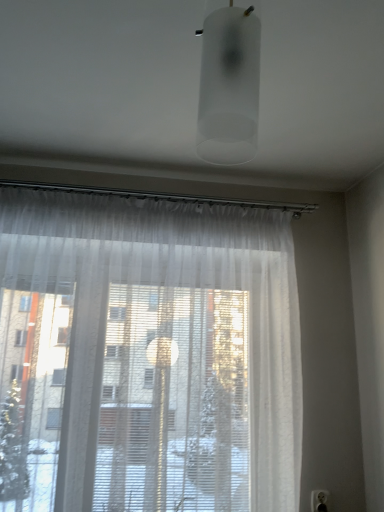
Question: Is sheer white curtain at center placed right next to white plastic electric outlet at lower right?

Choices:
 (A) no
 (B) yes

Answer: (A)

Question: Can you confirm if sheer white curtain at center is wider than white plastic electric outlet at lower right?

Choices:
 (A) yes
 (B) no

Answer: (A)

Question: Is white plastic electric outlet at lower right located within sheer white curtain at center?

Choices:
 (A) yes
 (B) no

Answer: (B)

Question: Does sheer white curtain at center have a lesser height compared to white plastic electric outlet at lower right?

Choices:
 (A) yes
 (B) no

Answer: (B)

Question: Is the position of sheer white curtain at center more distant than that of white plastic electric outlet at lower right?

Choices:
 (A) yes
 (B) no

Answer: (B)

Question: Is sheer white curtain at center facing away from white plastic electric outlet at lower right?

Choices:
 (A) no
 (B) yes

Answer: (A)

Question: Would you consider white plastic electric outlet at lower right to be distant from sheer white curtain at center?

Choices:
 (A) no
 (B) yes

Answer: (A)

Question: Is white plastic electric outlet at lower right beside sheer white curtain at center?

Choices:
 (A) no
 (B) yes

Answer: (A)

Question: Considering the relative sizes of white plastic electric outlet at lower right and sheer white curtain at center in the image provided, is white plastic electric outlet at lower right taller than sheer white curtain at center?

Choices:
 (A) yes
 (B) no

Answer: (B)

Question: Considering the relative sizes of white plastic electric outlet at lower right and sheer white curtain at center in the image provided, is white plastic electric outlet at lower right thinner than sheer white curtain at center?

Choices:
 (A) yes
 (B) no

Answer: (A)

Question: Is sheer white curtain at center a part of white plastic electric outlet at lower right?

Choices:
 (A) no
 (B) yes

Answer: (A)

Question: Considering the relative sizes of white plastic electric outlet at lower right and sheer white curtain at center in the image provided, is white plastic electric outlet at lower right smaller than sheer white curtain at center?

Choices:
 (A) no
 (B) yes

Answer: (B)

Question: Does sheer white curtain at center lie in front of frosted glass cylinder at upper center?

Choices:
 (A) no
 (B) yes

Answer: (A)